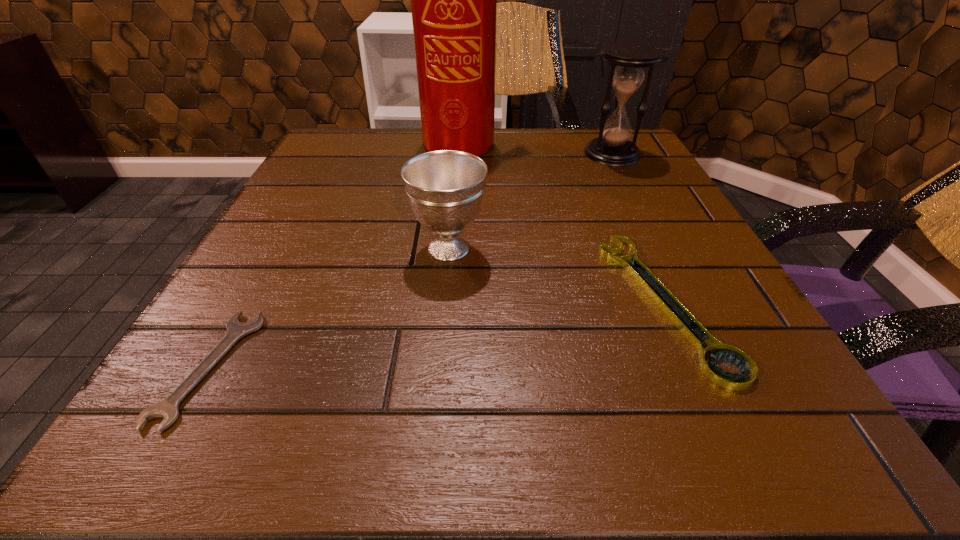
At what (x,y) coordinates should I click in order to perform the action: click on free spot located on the left of the fourth tallest object. Please return your answer as a coordinate pair (x, y). The width and height of the screenshot is (960, 540). Looking at the image, I should click on (376, 302).

In order to click on free space located on the back of the shorter wrench in this screenshot , I will do `click(289, 226)`.

Identify the location of fire extinguisher positioned at the far edge. (453, 0).

You are a GUI agent. You are given a task and a screenshot of the screen. Output one action in this format:
    pyautogui.click(x=<x>, y=<y>)
    Task: Click on the hourglass that is at the far edge
    The height and width of the screenshot is (540, 960).
    Given the screenshot: What is the action you would take?
    pyautogui.click(x=612, y=147)

Where is `object that is at the left edge`? Image resolution: width=960 pixels, height=540 pixels. object that is at the left edge is located at coordinates (168, 408).

Identify the location of hourglass that is at the right edge. (612, 147).

You are a GUI agent. You are given a task and a screenshot of the screen. Output one action in this format:
    pyautogui.click(x=<x>, y=<y>)
    Task: Click on the wrench that is at the right edge
    Image resolution: width=960 pixels, height=540 pixels.
    Given the screenshot: What is the action you would take?
    pyautogui.click(x=696, y=333)

Identify the location of object that is at the near left corner. This screenshot has width=960, height=540. (168, 408).

Where is `object that is at the far right corner`? This screenshot has height=540, width=960. object that is at the far right corner is located at coordinates (612, 147).

This screenshot has width=960, height=540. I want to click on object at the near right corner, so click(696, 333).